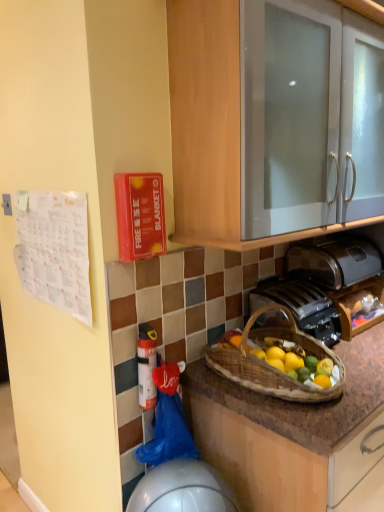
Question: Considering their positions, is metallic silver toaster at lower center located in front of or behind white glossy cabinet at upper center?

Choices:
 (A) behind
 (B) front

Answer: (A)

Question: From a real-world perspective, relative to white glossy cabinet at upper center, is metallic silver toaster at lower center vertically above or below?

Choices:
 (A) below
 (B) above

Answer: (A)

Question: Which object is positioned farthest from the white glossy cabinet at upper center?

Choices:
 (A) white plastic extinguisher at lower center
 (B) brown woven picnic basket at lower center
 (C) metallic silver toaster at lower center
 (D) satin silver toaster at lower right

Answer: (A)

Question: Which object is the closest to the metallic silver toaster at lower center?

Choices:
 (A) white plastic extinguisher at lower center
 (B) white glossy cabinet at upper center
 (C) satin silver toaster at lower right
 (D) brown woven picnic basket at lower center

Answer: (D)